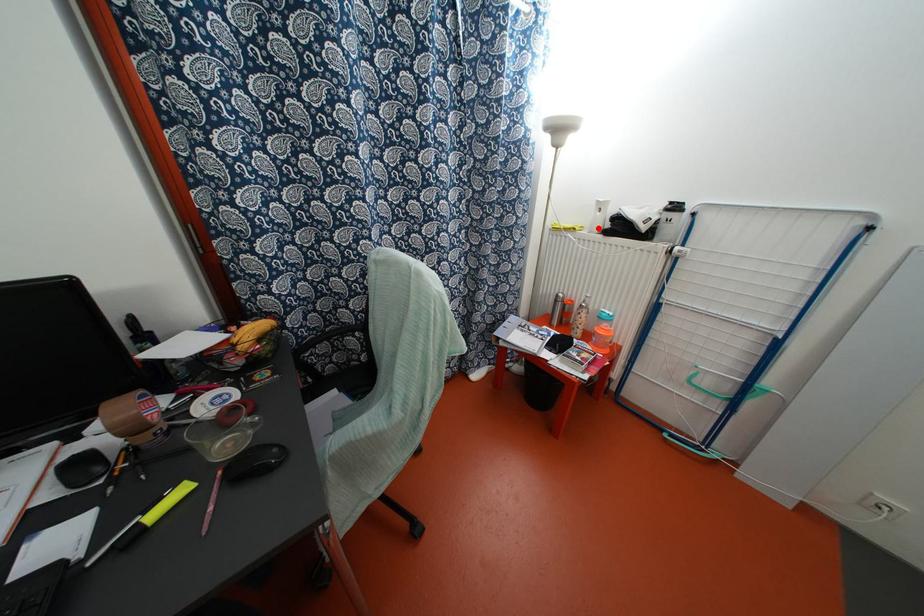
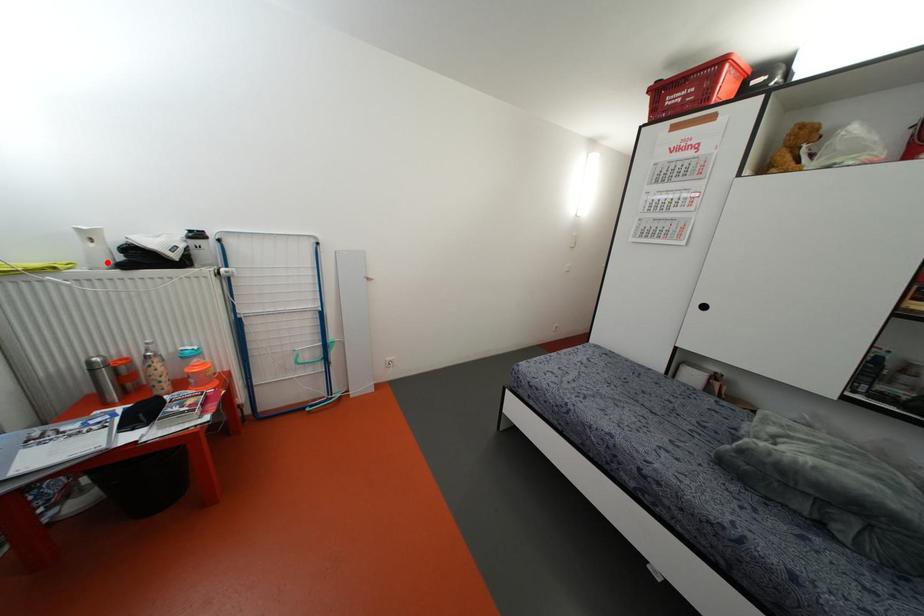
I am providing you with two images of the same scene from different viewpoints. A red point is marked on the first image and another point is marked on the second image. Is the red point in image1 aligned with the point shown in image2?

Yes